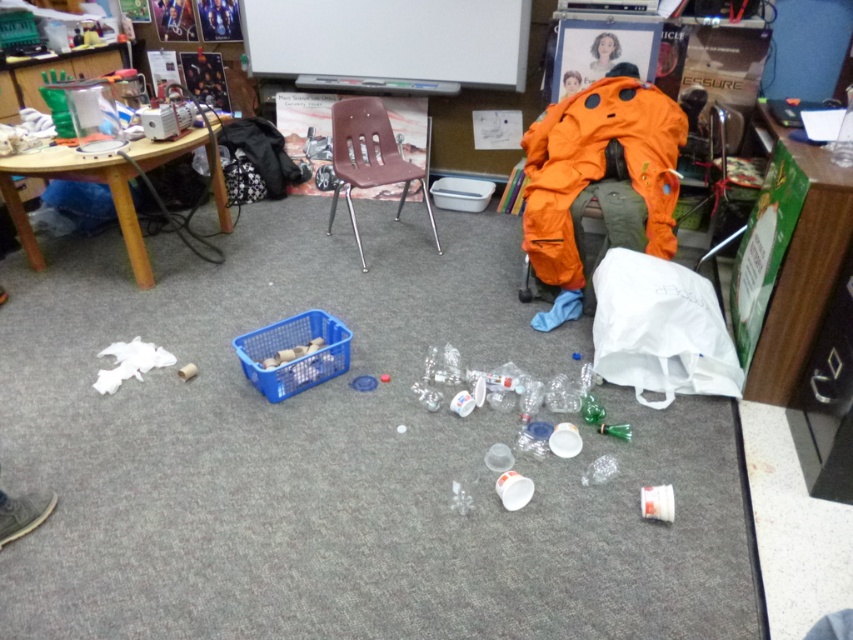
Question: Which of the following is the farthest from the observer?

Choices:
 (A) (369, 125)
 (B) (566, 83)

Answer: (B)

Question: Among these objects, which one is farthest from the camera?

Choices:
 (A) orange fabric at center
 (B) blonde hair at upper center

Answer: (A)

Question: Is blonde hair at upper center positioned at the back of orange fabric at center?

Choices:
 (A) no
 (B) yes

Answer: (A)

Question: Does brown plastic chair at center appear under blonde hair at upper center?

Choices:
 (A) yes
 (B) no

Answer: (A)

Question: Where is blonde hair at upper center located in relation to orange fabric at center in the image?

Choices:
 (A) above
 (B) below

Answer: (A)

Question: Which point is closer to the camera?

Choices:
 (A) (349, 193)
 (B) (576, 90)
 (C) (608, 60)

Answer: (A)